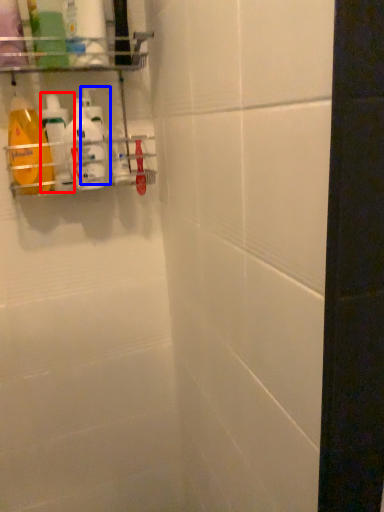
Question: Among these objects, which one is nearest to the camera, cleaning product (highlighted by a red box) or cleaning product (highlighted by a blue box)?

Choices:
 (A) cleaning product
 (B) cleaning product

Answer: (A)